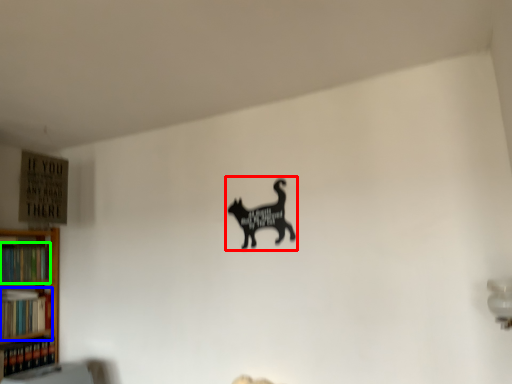
Question: Which object is positioned closest to animal (highlighted by a red box)? Select from book (highlighted by a blue box) and book (highlighted by a green box).

Choices:
 (A) book
 (B) book

Answer: (B)